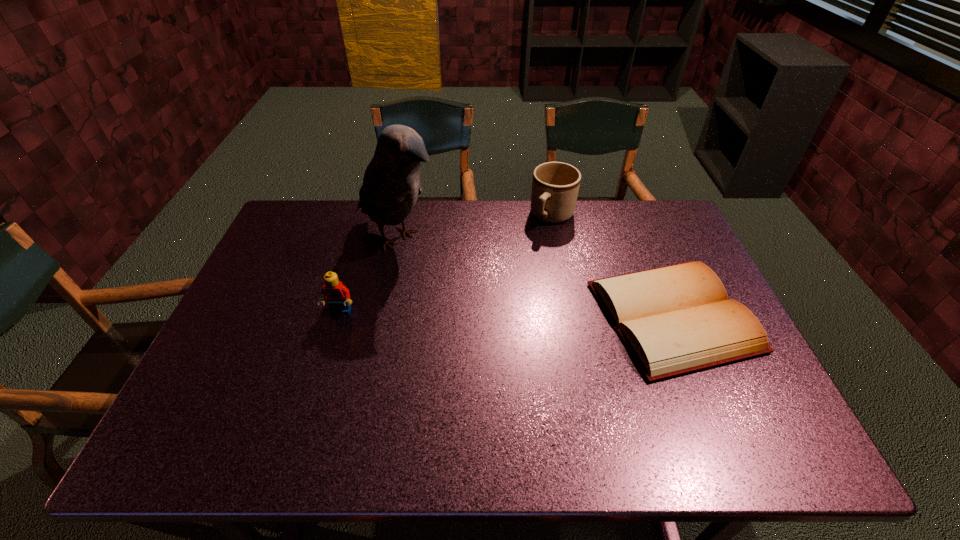
Where is `Lego`? The height and width of the screenshot is (540, 960). Lego is located at coordinates (337, 295).

This screenshot has width=960, height=540. Find the location of `the shortest object`. the shortest object is located at coordinates (677, 319).

Find the location of a particular element. The height and width of the screenshot is (540, 960). the tallest object is located at coordinates tap(391, 184).

The width and height of the screenshot is (960, 540). Identify the location of mug. (555, 185).

You are a GUI agent. You are given a task and a screenshot of the screen. Output one action in this format:
    pyautogui.click(x=<x>, y=<y>)
    Task: Click on the free space located 0.150m on the face of the Lego
    Image resolution: width=960 pixels, height=540 pixels.
    Given the screenshot: What is the action you would take?
    pyautogui.click(x=324, y=365)

The height and width of the screenshot is (540, 960). I want to click on blank space located on the left of the shortest object, so click(x=562, y=316).

Find the location of a particular element. vacant space located on the front-facing side of the parrot is located at coordinates (463, 280).

This screenshot has width=960, height=540. I want to click on free space located 0.190m on the front-facing side of the parrot, so click(x=473, y=287).

This screenshot has width=960, height=540. Find the location of `vacant space located 0.120m on the front-facing side of the parrot`. vacant space located 0.120m on the front-facing side of the parrot is located at coordinates (455, 275).

Locate an element on the screen. The width and height of the screenshot is (960, 540). vacant space positioned on the side of the mug with the handle is located at coordinates click(x=500, y=289).